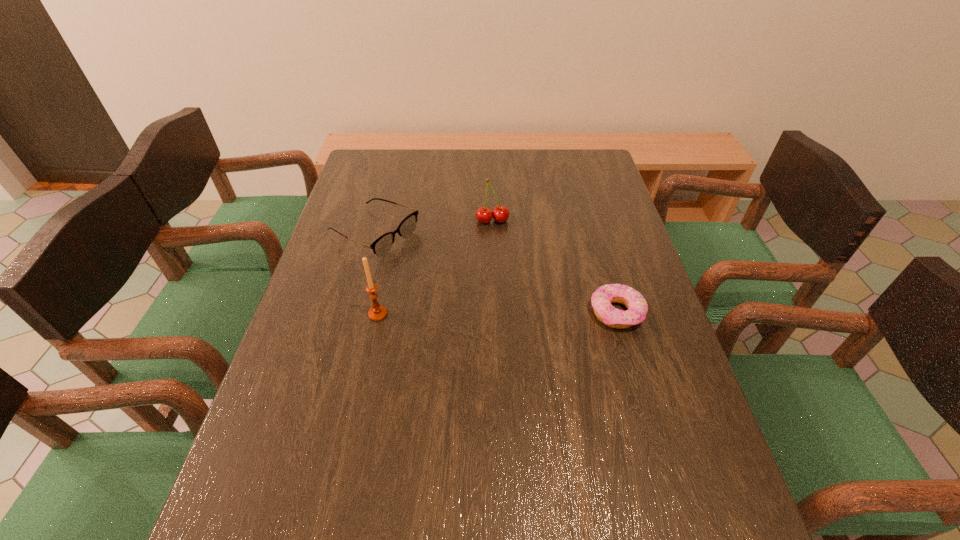
Identify the location of vacant region between the rightmost object and the spectacles. (495, 273).

Where is `free spot between the candle_holder and the spectacles`? free spot between the candle_holder and the spectacles is located at coordinates (376, 274).

I want to click on free spot between the third shortest object and the rightmost object, so click(x=555, y=267).

You are a GUI agent. You are given a task and a screenshot of the screen. Output one action in this format:
    pyautogui.click(x=<x>, y=<y>)
    Task: Click on the second closest object to the second object from right to left
    This screenshot has height=540, width=960.
    Given the screenshot: What is the action you would take?
    (x=601, y=299)

Identify which object is the nearest to the shortest object. Please provide its 2D coordinates. Your answer should be formatted as a tuple, i.e. [(x, y)], where the tuple contains the x and y coordinates of a point satisfying the conditions above.

[(484, 215)]

At what (x,y) coordinates should I click in order to perform the action: click on vacant space that satisfies the following two spatial constraints: 1. on the front side of the spectacles; 2. on the right side of the rightmost object. Please return your answer as a coordinate pair (x, y). Looking at the image, I should click on coord(353,313).

Image resolution: width=960 pixels, height=540 pixels. I want to click on free space that satisfies the following two spatial constraints: 1. on the front side of the spectacles; 2. on the left side of the shortest object, so click(x=353, y=313).

At what (x,y) coordinates should I click in order to perform the action: click on free space that satisfies the following two spatial constraints: 1. on the front side of the second shortest object; 2. on the right side of the tallest object. Please return your answer as a coordinate pair (x, y). The width and height of the screenshot is (960, 540). Looking at the image, I should click on (353, 314).

What are the coordinates of `free space in the image that satisfies the following two spatial constraints: 1. on the back side of the rightmost object; 2. on the right side of the candle_holder` in the screenshot? It's located at (378, 313).